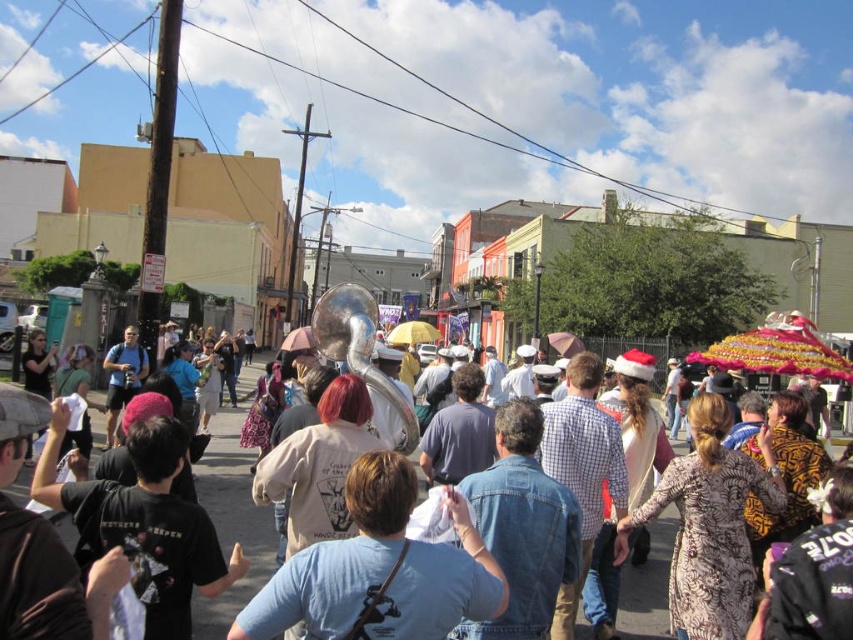
Identify the location of blue denim shirt at center. (380, 570).

Is point (428, 572) less distant than point (648, 580)?

Yes, it is.

Describe the element at coordinates (380, 570) in the screenshot. The height and width of the screenshot is (640, 853). I see `blue denim shirt at center` at that location.

Where is `blue denim shirt at center`? The width and height of the screenshot is (853, 640). blue denim shirt at center is located at coordinates (380, 570).